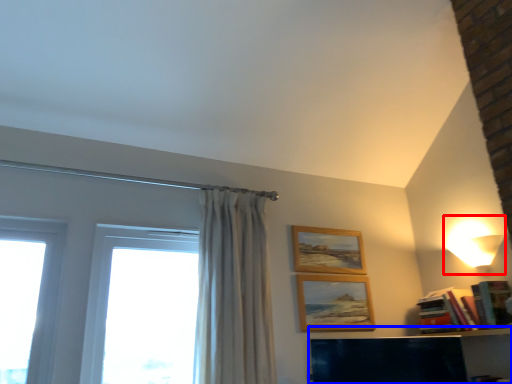
Question: Which object is further to the camera taking this photo, lamp (highlighted by a red box) or shelf (highlighted by a blue box)?

Choices:
 (A) lamp
 (B) shelf

Answer: (A)